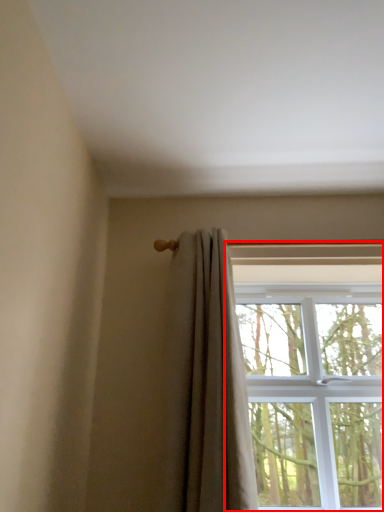
Question: From the image's perspective, where is window (annotated by the red box) located relative to curtain?

Choices:
 (A) above
 (B) below

Answer: (B)